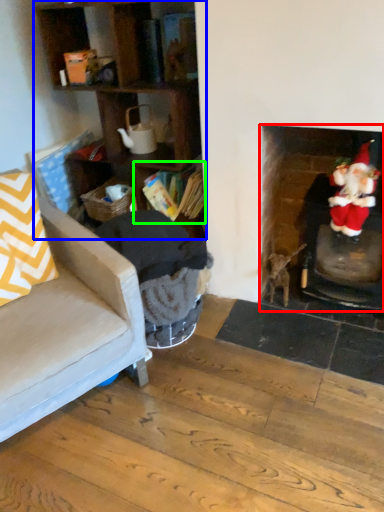
Question: Which is nearer to the fireplace (highlighted by a red box)? cabinetry (highlighted by a blue box) or shelf (highlighted by a green box).

Choices:
 (A) cabinetry
 (B) shelf

Answer: (B)